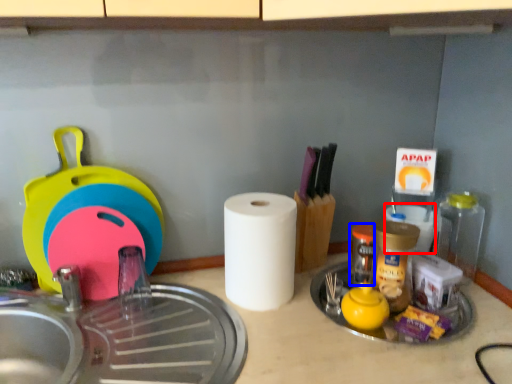
Question: Which object appears closest to the camera in this image, paper towel (highlighted by a red box) or bottle (highlighted by a blue box)?

Choices:
 (A) paper towel
 (B) bottle

Answer: (B)